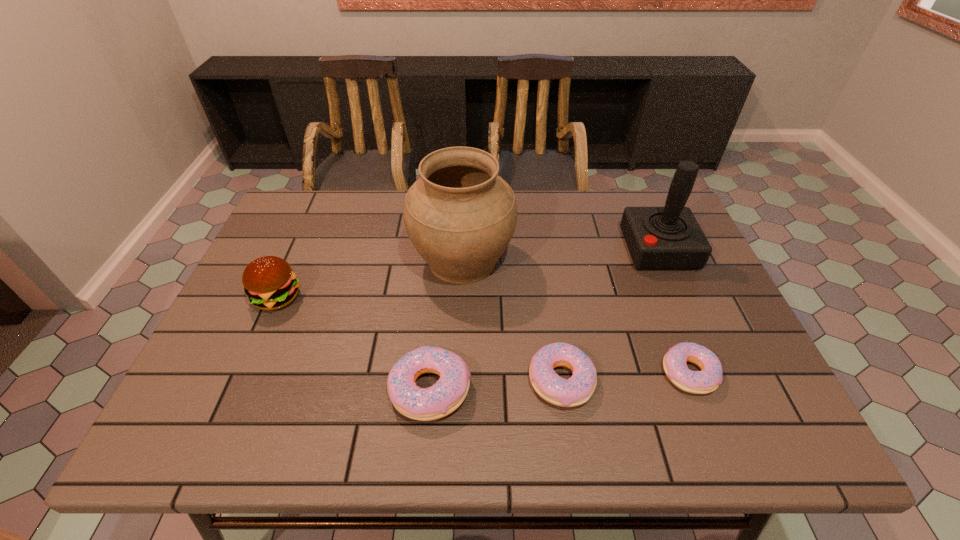
You are a GUI agent. You are given a task and a screenshot of the screen. Output one action in this format:
    pyautogui.click(x=<x>, y=<y>)
    Task: Click on the free space between the urn and the joystick
    Image resolution: width=960 pixels, height=540 pixels.
    Given the screenshot: What is the action you would take?
    pyautogui.click(x=561, y=255)

Image resolution: width=960 pixels, height=540 pixels. I want to click on free space between the joystick and the rightmost doughnut, so click(674, 311).

The height and width of the screenshot is (540, 960). What are the coordinates of `free space between the leftmost doughnut and the second tallest doughnut` in the screenshot? It's located at (496, 385).

I want to click on free space between the second doughnut from left to right and the urn, so click(512, 321).

Image resolution: width=960 pixels, height=540 pixels. I want to click on vacant space that's between the second doughnut from left to right and the leftmost doughnut, so pyautogui.click(x=496, y=385).

The image size is (960, 540). Identify the location of free space that is in between the shortest object and the joystick. (674, 311).

The image size is (960, 540). Identify the location of free space that is in between the urn and the rightmost doughnut. (576, 316).

Locate an element on the screen. The image size is (960, 540). unoccupied area between the leftmost doughnut and the fourth shortest object is located at coordinates (353, 343).

Select which object appears as the fifth closest to the rightmost doughnut. Please provide its 2D coordinates. Your answer should be formatted as a tuple, i.e. [(x, y)], where the tuple contains the x and y coordinates of a point satisfying the conditions above.

[(269, 282)]

The height and width of the screenshot is (540, 960). Find the location of `object that is the fourth closest one to the urn`. object that is the fourth closest one to the urn is located at coordinates (658, 238).